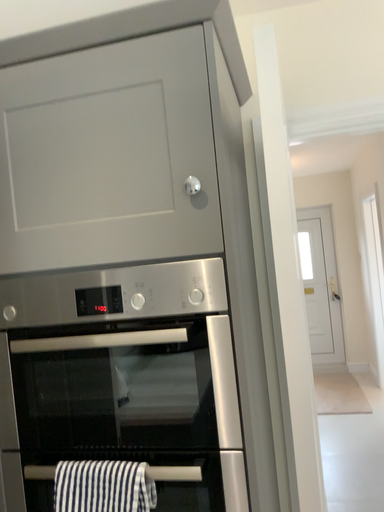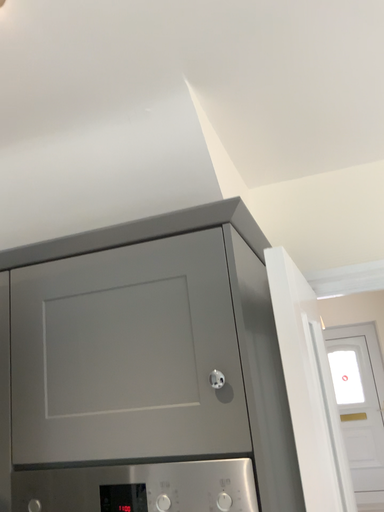
Question: How did the camera likely rotate when shooting the video?

Choices:
 (A) rotated downward
 (B) rotated upward

Answer: (B)